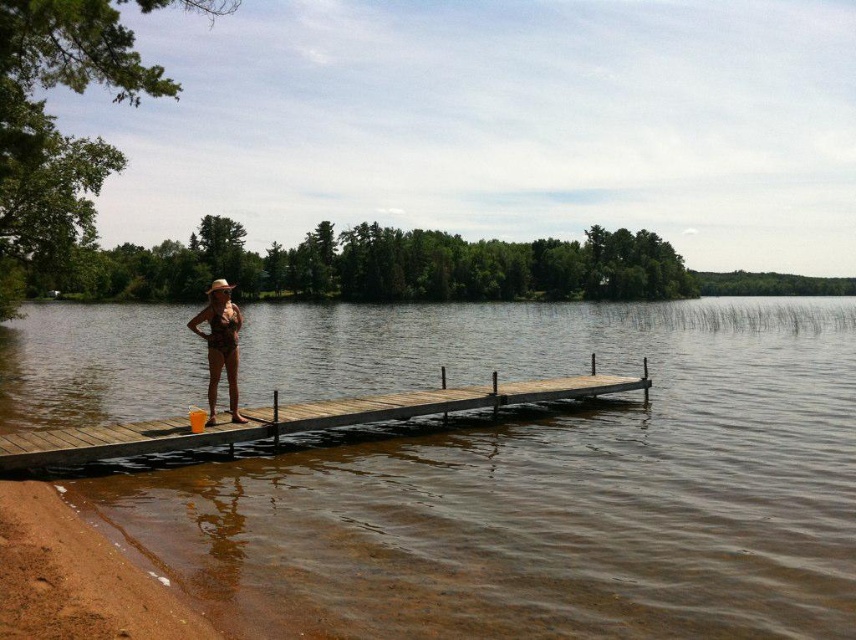
Describe the element at coordinates (530, 477) in the screenshot. The height and width of the screenshot is (640, 856). I see `brown wooden dock at center` at that location.

Can you confirm if brown wooden dock at center is smaller than wooden dock at center?

Incorrect, brown wooden dock at center is not smaller in size than wooden dock at center.

What do you see at coordinates (530, 477) in the screenshot? I see `brown wooden dock at center` at bounding box center [530, 477].

Identify the location of brown wooden dock at center. This screenshot has width=856, height=640. (530, 477).

Does brown wooden dock at center have a greater width compared to matte brown bikini at center?

Yes.

The width and height of the screenshot is (856, 640). What do you see at coordinates (530, 477) in the screenshot? I see `brown wooden dock at center` at bounding box center [530, 477].

The height and width of the screenshot is (640, 856). I want to click on brown wooden dock at center, so pos(530,477).

From the picture: Is wooden dock at center to the right of matte brown bikini at center from the viewer's perspective?

Indeed, wooden dock at center is positioned on the right side of matte brown bikini at center.

Does wooden dock at center lie in front of matte brown bikini at center?

Yes.

Does point (524, 392) come farther from viewer compared to point (221, 284)?

That is True.

I want to click on wooden dock at center, so click(290, 419).